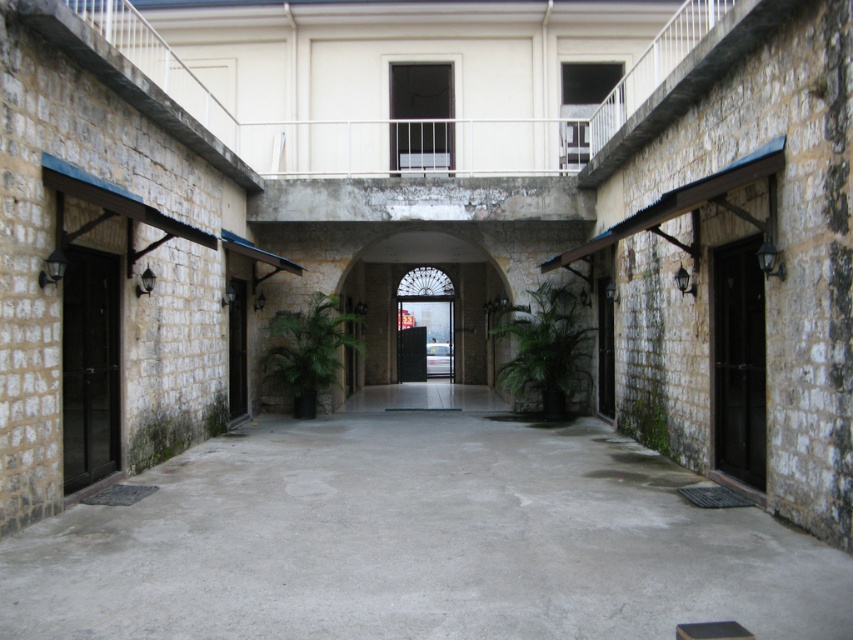
Which is above, smooth stone archway at center or black matte door at left?

smooth stone archway at center is higher up.

Can you confirm if smooth stone archway at center is positioned below black matte door at left?

No, smooth stone archway at center is not below black matte door at left.

Is point (451, 314) closer to camera compared to point (96, 445)?

No, (451, 314) is further to viewer.

Locate an element on the screen. Image resolution: width=853 pixels, height=640 pixels. smooth stone archway at center is located at coordinates (426, 308).

Does point (80, 390) come behind point (234, 387)?

No.

Is black matte door at left in front of brown wooden door at center?

A: Yes, black matte door at left is in front of brown wooden door at center.

Measure the distance between black matte door at left and camera.

They are 6.72 meters apart.

This screenshot has width=853, height=640. Identify the location of black matte door at left. (90, 365).

Does smooth stone archway at center have a larger size compared to brown wooden door at center?

Yes, smooth stone archway at center is bigger than brown wooden door at center.

Can you confirm if smooth stone archway at center is taller than brown wooden door at center?

Yes.

Is point (358, 264) less distant than point (236, 304)?

No, (358, 264) is behind (236, 304).

What are the coordinates of `smooth stone archway at center` in the screenshot? It's located at (426, 308).